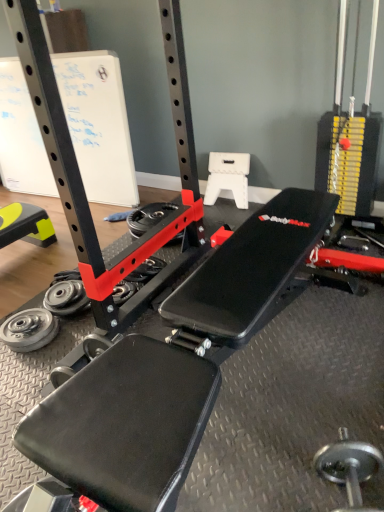
Locate an element on the screen. This screenshot has width=384, height=512. vacant region to the left of silver metallic dumbbell at lower right is located at coordinates (268, 478).